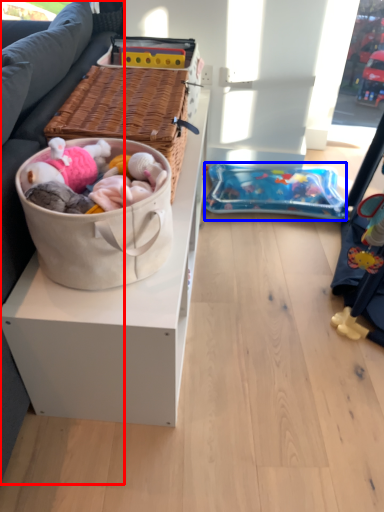
Question: Which object is closer to the camera taking this photo, studio couch (highlighted by a red box) or infant bed (highlighted by a blue box)?

Choices:
 (A) studio couch
 (B) infant bed

Answer: (A)